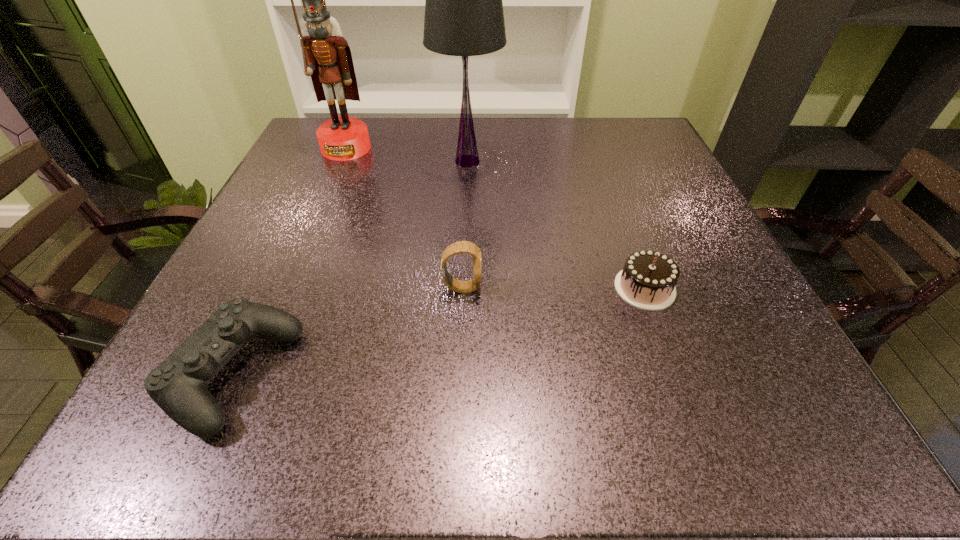
Locate an element on the screen. vacant area between the lampshade and the nearest object is located at coordinates (350, 268).

At what (x,y) coordinates should I click in order to perform the action: click on free space between the watch and the nearest object. Please return your answer as a coordinate pair (x, y). The height and width of the screenshot is (540, 960). Looking at the image, I should click on (348, 332).

Locate an element on the screen. The width and height of the screenshot is (960, 540). vacant space that is in between the lampshade and the watch is located at coordinates (465, 225).

The image size is (960, 540). Find the location of `unoccupied position between the third shortest object and the nearest object`. unoccupied position between the third shortest object and the nearest object is located at coordinates (348, 332).

I want to click on object that is the second closest to the nearest object, so click(464, 16).

Identify which object is located as the third nearest to the nearest object. Please provide its 2D coordinates. Your answer should be formatted as a tuple, i.e. [(x, y)], where the tuple contains the x and y coordinates of a point satisfying the conditions above.

[(327, 58)]

Identify the location of free space that satisfies the following two spatial constraints: 1. on the front-facing side of the lampshade; 2. on the face of the third tallest object. This screenshot has width=960, height=540. (463, 288).

This screenshot has height=540, width=960. In order to click on free space that satisfies the following two spatial constraints: 1. on the front-facing side of the nutcracker; 2. on the left side of the rightmost object in this screenshot , I will do `click(286, 288)`.

This screenshot has width=960, height=540. I want to click on free location that satisfies the following two spatial constraints: 1. on the front-facing side of the fourth shortest object; 2. on the face of the watch, so click(463, 288).

This screenshot has width=960, height=540. I want to click on vacant space that satisfies the following two spatial constraints: 1. on the front-facing side of the lampshade; 2. on the right side of the chocolate cake, so click(463, 288).